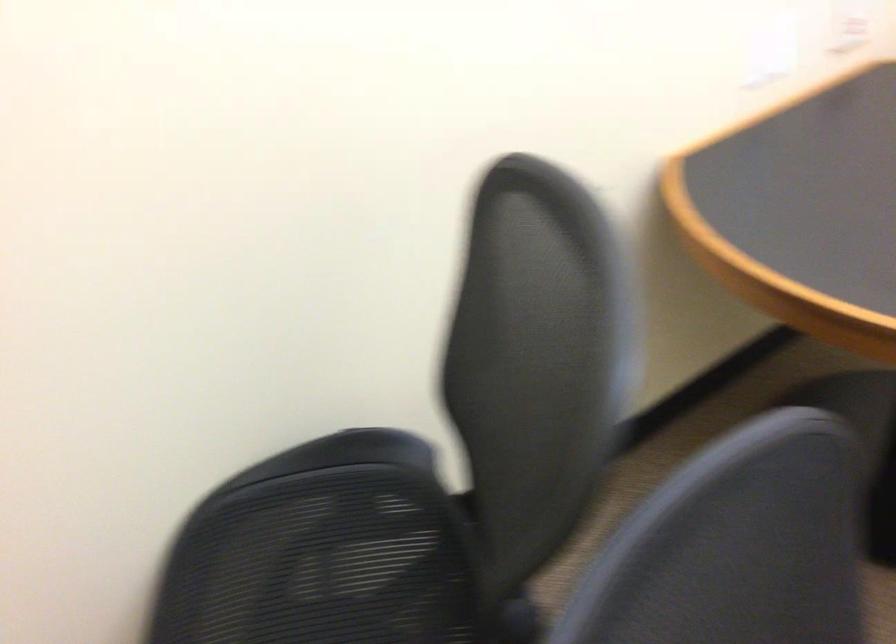
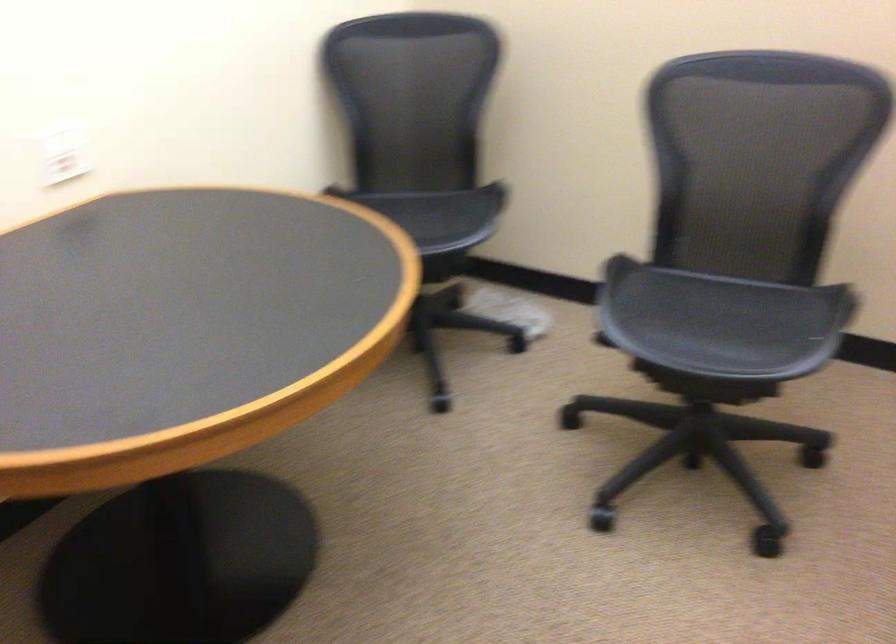
Question: The camera is either moving clockwise (left) or counter-clockwise (right) around the object. The first image is from the beginning of the video and the second image is from the end. Is the camera moving left or right when shooting the video?

Choices:
 (A) Left
 (B) Right

Answer: (A)